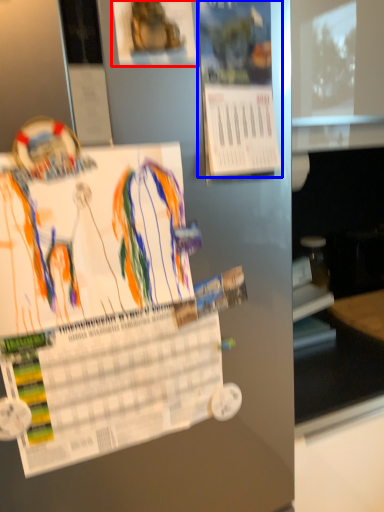
Question: Which object is closer to the camera taking this photo, poster (highlighted by a red box) or poster (highlighted by a blue box)?

Choices:
 (A) poster
 (B) poster

Answer: (A)